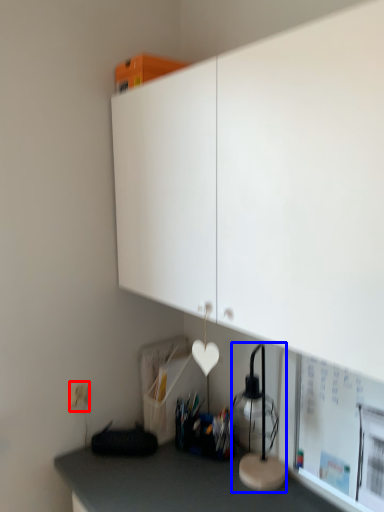
Question: Which point is closer to the camera, electric outlet (highlighted by a red box) or table lamp (highlighted by a blue box)?

Choices:
 (A) electric outlet
 (B) table lamp

Answer: (B)